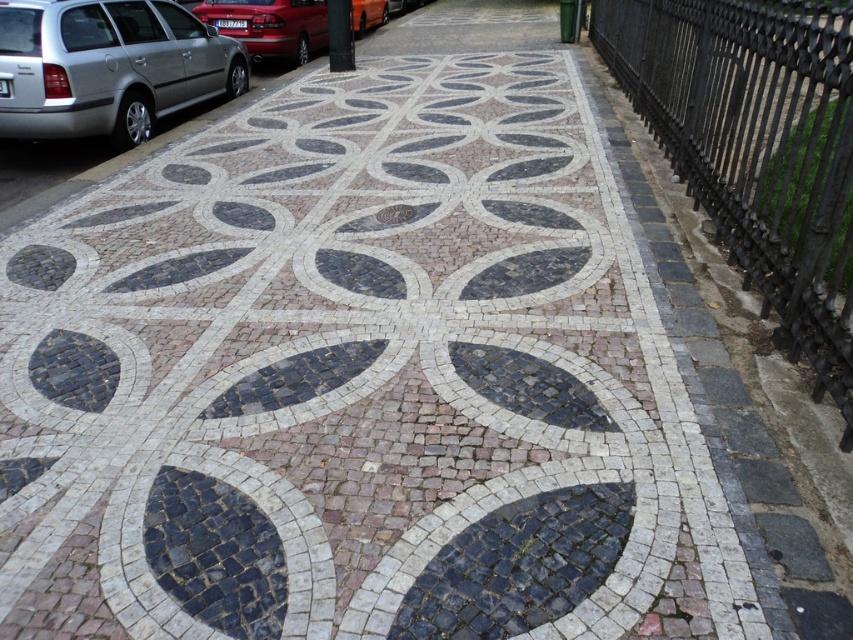
What do you see at coordinates (756, 148) in the screenshot?
I see `black wrought iron fence at right` at bounding box center [756, 148].

Does black wrought iron fence at right have a larger size compared to metallic red car at upper left?

Incorrect, black wrought iron fence at right is not larger than metallic red car at upper left.

Image resolution: width=853 pixels, height=640 pixels. I want to click on black wrought iron fence at right, so click(756, 148).

Who is shorter, dark gray mosaic leaf at center or metallic red car at upper left?

Standing shorter between the two is dark gray mosaic leaf at center.

Where is `dark gray mosaic leaf at center`? dark gray mosaic leaf at center is located at coordinates (213, 550).

Does silver metallic car at left have a lesser height compared to metallic red car at upper left?

→ No.

Which is more to the left, silver metallic car at left or metallic red car at upper left?

From the viewer's perspective, silver metallic car at left appears more on the left side.

Between point (171, 49) and point (202, 1), which one is positioned in front?

Point (171, 49) is more forward.

Find the location of a particular element. silver metallic car at left is located at coordinates (107, 67).